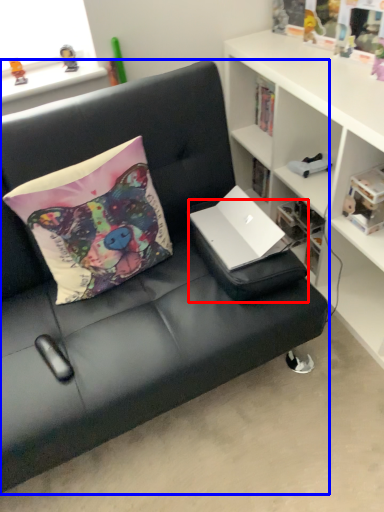
Question: Which object appears farthest to the camera in this image, footrest (highlighted by a red box) or studio couch (highlighted by a blue box)?

Choices:
 (A) footrest
 (B) studio couch

Answer: (A)